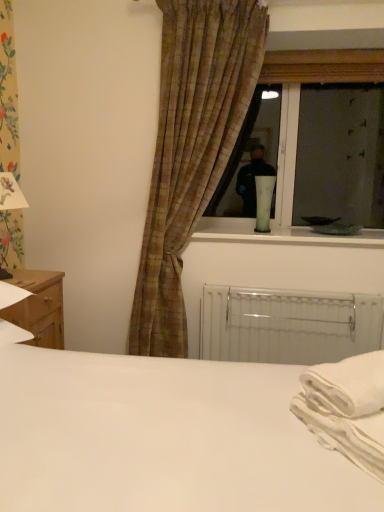
Find the location of `free point to the right of green glass vase at window, which is counted as the second table lamp, starting from the left`. free point to the right of green glass vase at window, which is counted as the second table lamp, starting from the left is located at coordinates (289, 236).